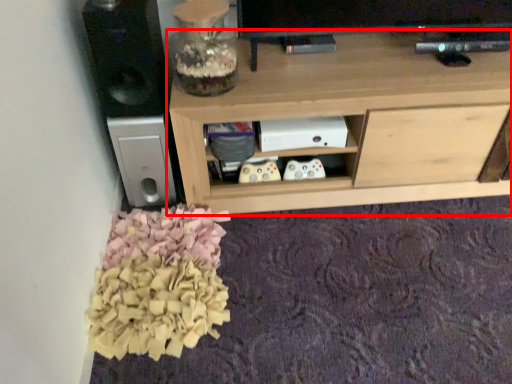
Question: From the image, what is the correct spatial relationship of shelf (annotated by the red box) in relation to speaker?

Choices:
 (A) left
 (B) right

Answer: (B)